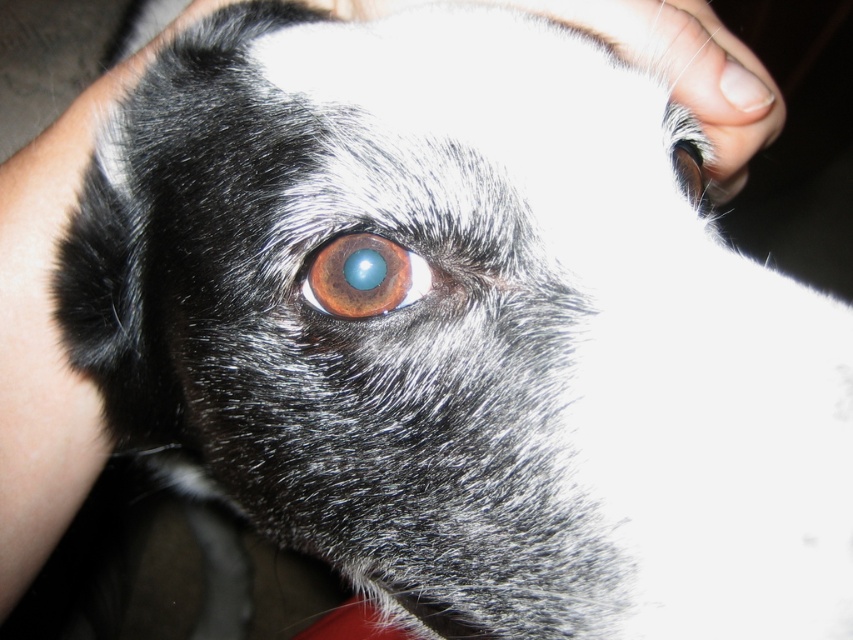
Question: Among these points, which one is nearest to the camera?

Choices:
 (A) (656, 54)
 (B) (410, 262)

Answer: (B)

Question: Which of the following is the closest to the observer?

Choices:
 (A) (701, 147)
 (B) (711, 33)
 (C) (361, 262)

Answer: (C)

Question: Is white fur at upper center positioned in front of shiny black eye at upper right?

Choices:
 (A) yes
 (B) no

Answer: (B)

Question: Is brown glossy eye at center to the right of shiny black eye at upper right from the viewer's perspective?

Choices:
 (A) yes
 (B) no

Answer: (B)

Question: Does brown glossy eye at center have a smaller size compared to shiny black eye at upper right?

Choices:
 (A) no
 (B) yes

Answer: (B)

Question: Considering the real-world distances, which object is farthest from the white fur at upper center?

Choices:
 (A) shiny black eye at upper right
 (B) brown glossy eye at center

Answer: (B)